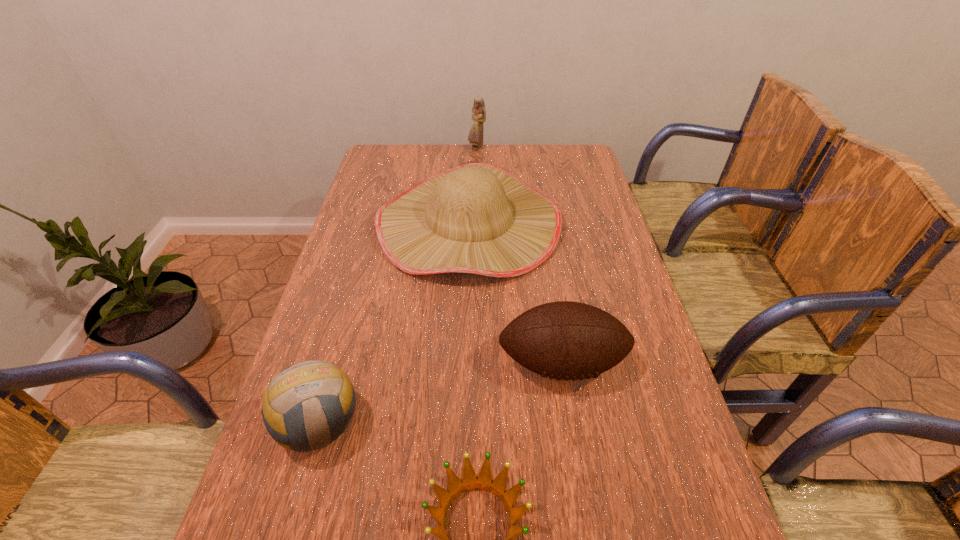
Where is `free point between the farthest object and the volleyball`? The width and height of the screenshot is (960, 540). free point between the farthest object and the volleyball is located at coordinates (398, 286).

The image size is (960, 540). What are the coordinates of `vacant area that lies between the farthest object and the volleyball` in the screenshot? It's located at (398, 286).

At what (x,y) coordinates should I click in order to perform the action: click on object that stands as the third closest to the nearest object. Please return your answer as a coordinate pair (x, y). The width and height of the screenshot is (960, 540). Looking at the image, I should click on (479, 218).

Point out which object is positioned as the fourth nearest to the volleyball. Please provide its 2D coordinates. Your answer should be formatted as a tuple, i.e. [(x, y)], where the tuple contains the x and y coordinates of a point satisfying the conditions above.

[(475, 137)]